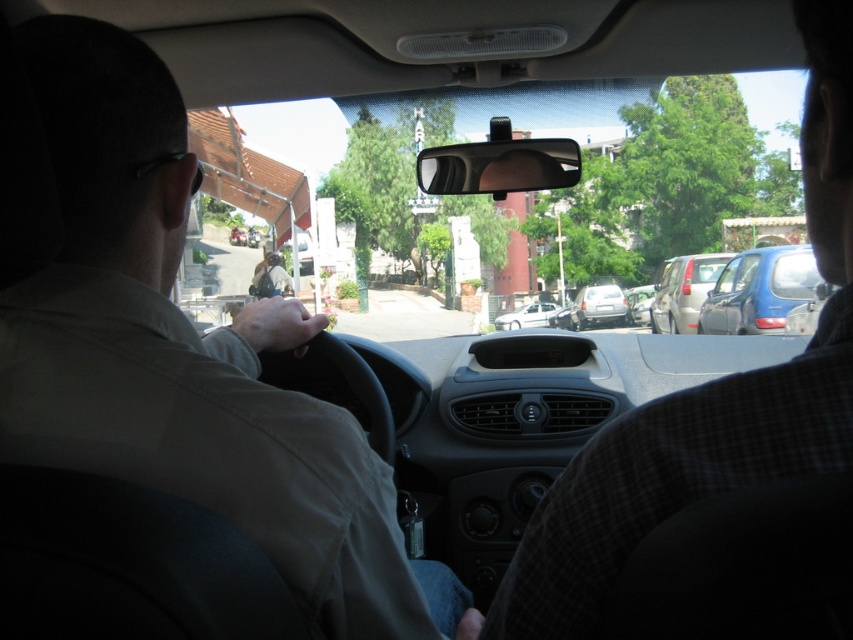
Where is `checkered fabric shirt at right`? checkered fabric shirt at right is located at coordinates (706, 401).

Does point (718, 461) lie behind point (614, 312)?

No, (718, 461) is closer to viewer.

What do you see at coordinates (706, 401) in the screenshot? The width and height of the screenshot is (853, 640). I see `checkered fabric shirt at right` at bounding box center [706, 401].

This screenshot has width=853, height=640. I want to click on checkered fabric shirt at right, so click(706, 401).

From the picture: Who is taller, satin silver sedan at center or white matte sedan at center?

Standing taller between the two is satin silver sedan at center.

Can you confirm if satin silver sedan at center is positioned to the right of white matte sedan at center?

Indeed, satin silver sedan at center is positioned on the right side of white matte sedan at center.

What do you see at coordinates (598, 307) in the screenshot? Image resolution: width=853 pixels, height=640 pixels. I see `satin silver sedan at center` at bounding box center [598, 307].

This screenshot has height=640, width=853. Find the location of `satin silver sedan at center`. satin silver sedan at center is located at coordinates (598, 307).

Locate an element on the screen. blue matte car at right is located at coordinates 759,291.

Which is in front, point (743, 292) or point (660, 298)?

Point (743, 292) is more forward.

Where is `blue matte car at right`? This screenshot has width=853, height=640. blue matte car at right is located at coordinates (759, 291).